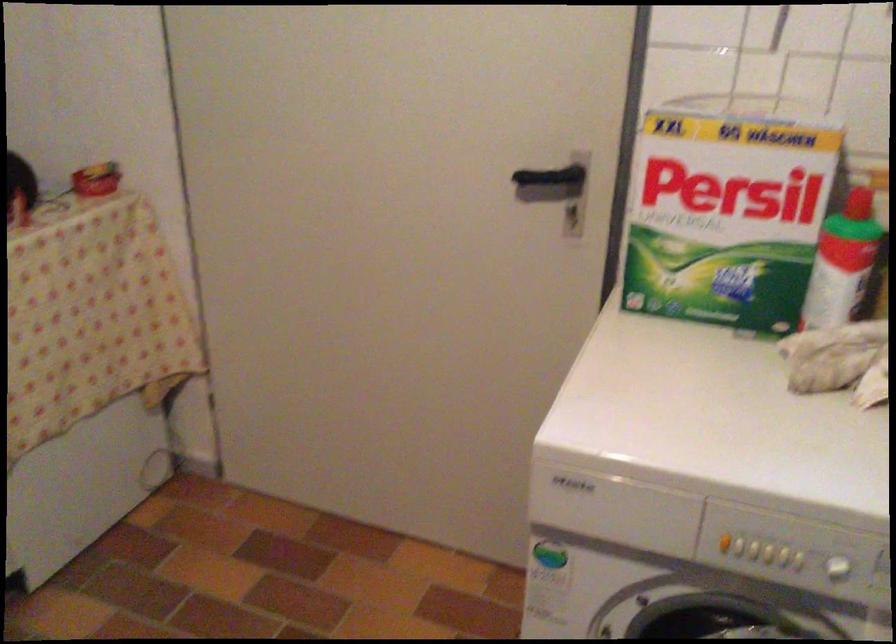
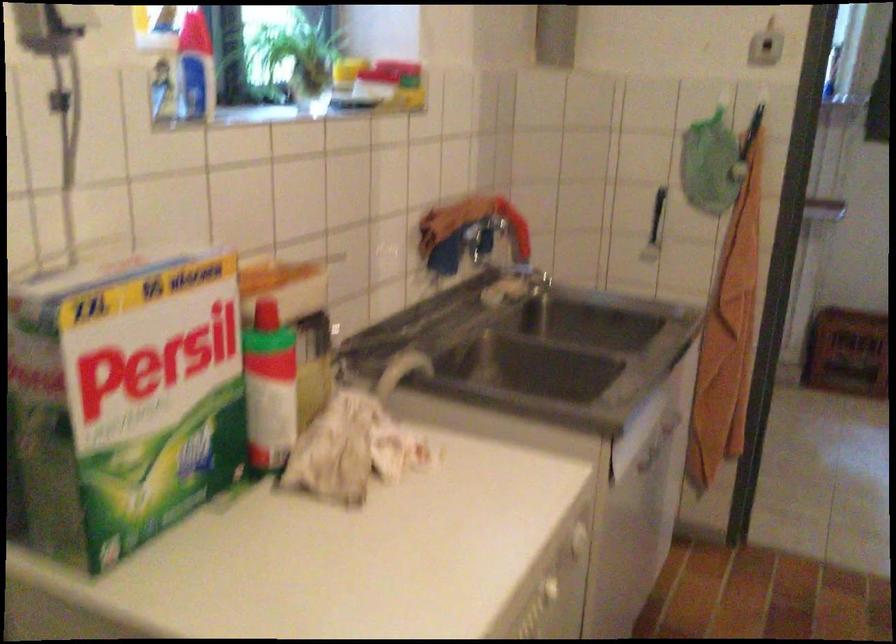
Question: The camera is either moving clockwise (left) or counter-clockwise (right) around the object. The first image is from the beginning of the video and the second image is from the end. Is the camera moving left or right when shooting the video?

Choices:
 (A) Left
 (B) Right

Answer: (A)